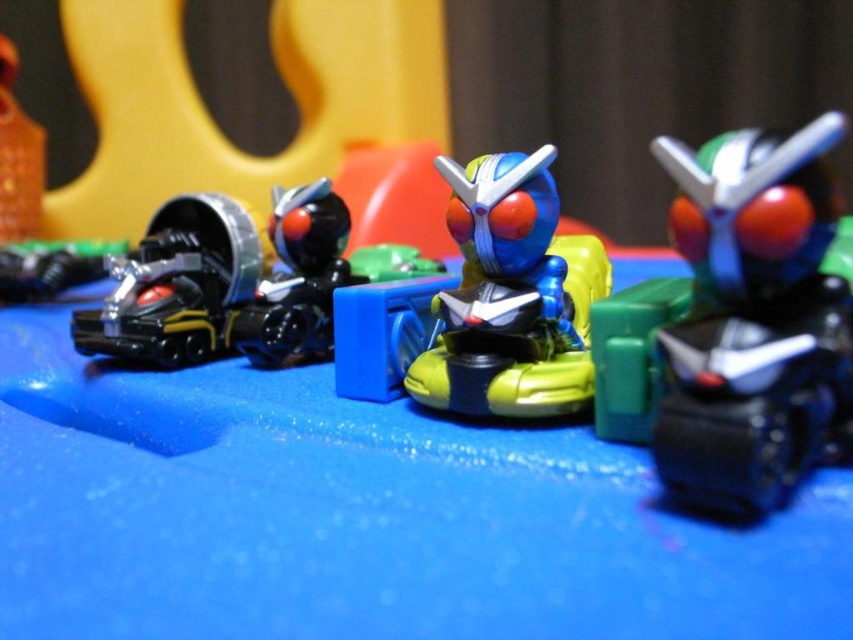
Is point (793, 358) in front of point (496, 371)?

Yes, point (793, 358) is closer to viewer.

This screenshot has height=640, width=853. What do you see at coordinates (738, 324) in the screenshot?
I see `green matte robot at right` at bounding box center [738, 324].

Is point (709, 387) positioned before point (477, 353)?

Yes.

Identify the location of green matte robot at right. coord(738,324).

The width and height of the screenshot is (853, 640). What are the coordinates of `green matte robot at right` in the screenshot? It's located at (738, 324).

Which is behind, point (706, 317) or point (289, 323)?

The point (289, 323) is more distant.

Where is `green matte robot at right`? Image resolution: width=853 pixels, height=640 pixels. green matte robot at right is located at coordinates (738, 324).

Who is shorter, shiny plastic robot at center or black plastic toy at left?

black plastic toy at left

Can you confirm if shiny plastic robot at center is positioned below black plastic toy at left?

Incorrect, shiny plastic robot at center is not positioned below black plastic toy at left.

Where is `shiny plastic robot at center`? The height and width of the screenshot is (640, 853). shiny plastic robot at center is located at coordinates (512, 296).